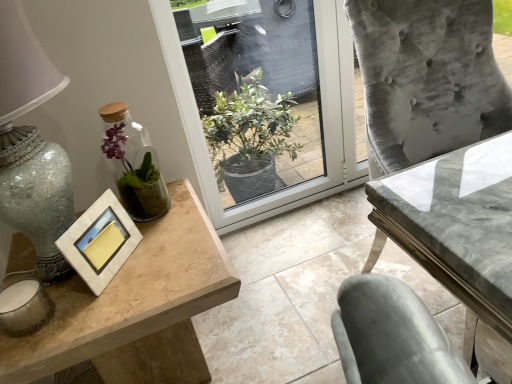
Locate an element on the screen. This screenshot has width=512, height=384. vacant region below transparent glass window at center (from a real-world perspective) is located at coordinates (274, 218).